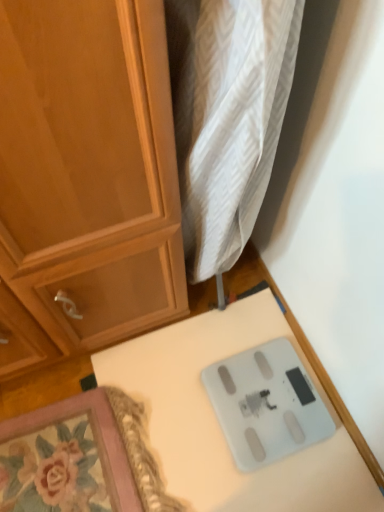
The width and height of the screenshot is (384, 512). What do you see at coordinates (219, 423) in the screenshot? I see `white glossy table at center` at bounding box center [219, 423].

Find the location of a particular element. white glossy table at center is located at coordinates coord(219,423).

I want to click on white glossy table at center, so click(219, 423).